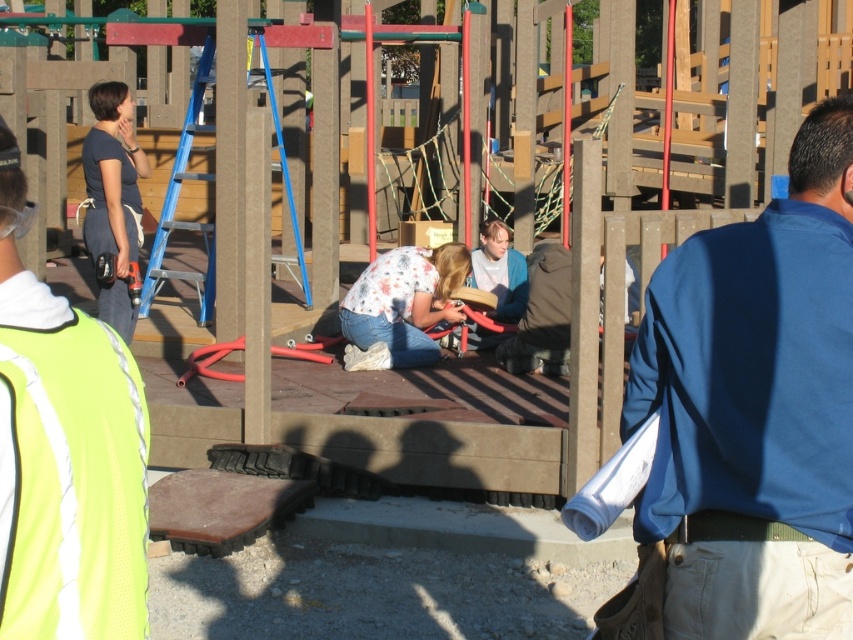
You are standing at the construction site looking at the playground structure. There are two points marked on the structure at coordinates point (659, 444) and point (53, 364). Which point is closer to you?

Point (53, 364) is closer to you because it is nearer to the camera compared to point (659, 444), which is further away.

You are a safety inspector at the construction site. You notice two workers, one wearing a blue fabric shirt at center and another in a neon yellow mesh safety vest at left. Which worker is wearing a wider garment?

The blue fabric shirt at center is wider than the neon yellow mesh safety vest at left.

You are a new worker arriving at the construction site and see the blue fabric shirt at center and the neon yellow mesh safety vest at left. Which person is closer to you?

The blue fabric shirt at center is closer to you because the neon yellow mesh safety vest at left is behind it.